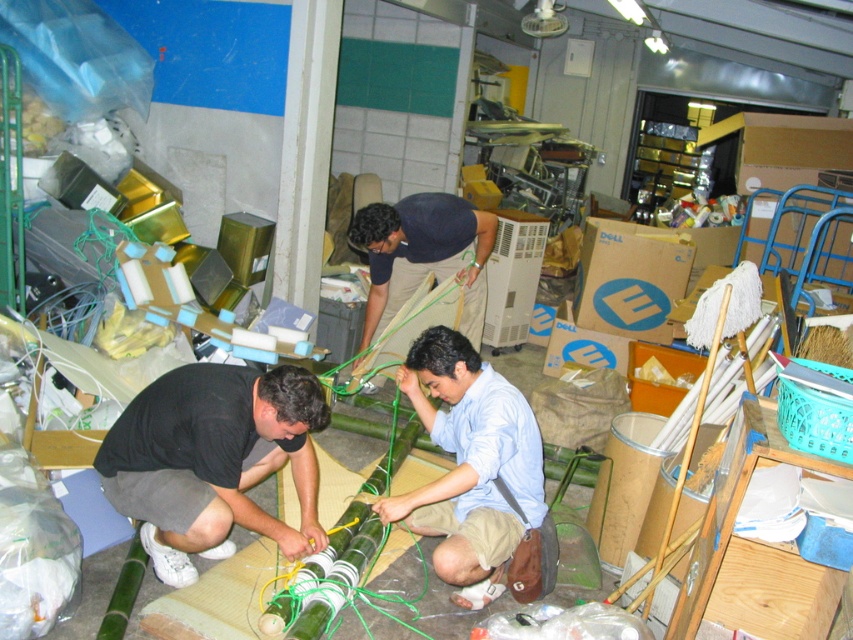
From the picture: You are a new worker in this workspace and need to find the light blue cotton shirt at center. Which direction should you move from the black matte shirt at lower left to locate it?

The light blue cotton shirt at center is to the right of the black matte shirt at lower left, so you should move to the right to locate it.

Based on the photo, you are standing at the entrance of the workspace and need to walk to the point labeled as point (408,528). There is an obstacle at point (280,400). Will you have to go around the obstacle to reach your destination?

Yes, you will have to go around the obstacle at point (280,400) because it is in front of point (408,528), blocking the direct path.

You are a delivery person who needs to navigate through the workspace to deliver a package to the person at the center. The path between the black matte shirt at lower left and the matte black shirt at center is narrow. Can your 2.5 feet wide delivery cart safely pass through this path?

The distance between the black matte shirt at lower left and the matte black shirt at center is 4.93 feet. Since the cart is 2.5 feet wide, there would be approximately 2.43 feet of space remaining on either side. This should be sufficient for the cart to pass safely through the path between the black matte shirt at lower left and the matte black shirt at center.